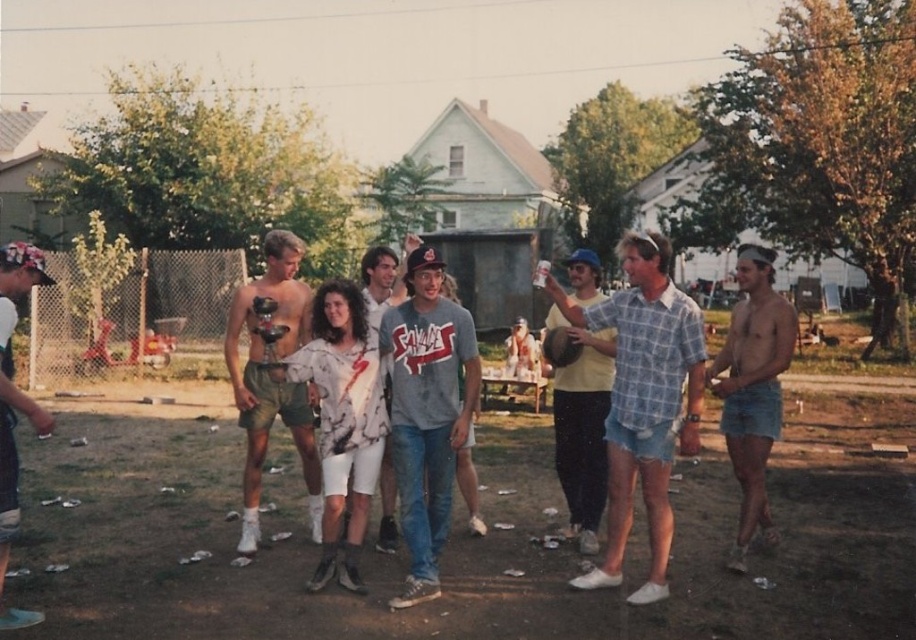
Question: Which object appears closest to the camera in this image?

Choices:
 (A) white cotton cap at left
 (B) gray cotton t-shirt at center
 (C) denim shorts at right

Answer: (A)

Question: Among these objects, which one is farthest from the camera?

Choices:
 (A) denim shorts at right
 (B) white cotton cap at left
 (C) gray cotton t-shirt at center
 (D) white cotton shirt at center

Answer: (D)

Question: Is white cotton shorts at center wider than white cotton cap at left?

Choices:
 (A) yes
 (B) no

Answer: (A)

Question: Considering the relative positions of shiny metallic trophy at center and denim shorts at right in the image provided, where is shiny metallic trophy at center located with respect to denim shorts at right?

Choices:
 (A) right
 (B) left

Answer: (B)

Question: Which object is farther from the camera taking this photo?

Choices:
 (A) plaid cotton shirt at center
 (B) shiny metallic trophy at center
 (C) white cotton shorts at center

Answer: (B)

Question: Does gray cotton t-shirt at center appear on the left side of shiny metallic trophy at center?

Choices:
 (A) no
 (B) yes

Answer: (A)